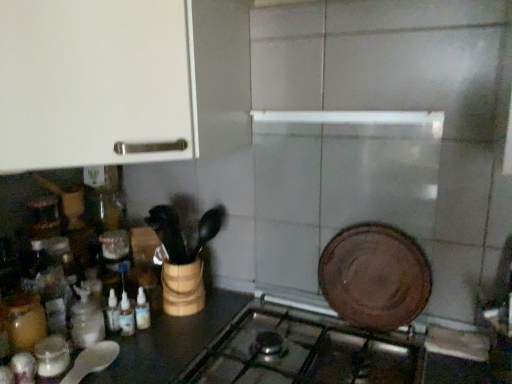
Question: Considering the relative sizes of translucent glass bottle at lower left, which is the 2th bottle from right to left, and white matte cabinet at upper left in the image provided, is translucent glass bottle at lower left, which is the 2th bottle from right to left, smaller than white matte cabinet at upper left?

Choices:
 (A) no
 (B) yes

Answer: (B)

Question: Considering the relative sizes of translucent glass bottle at lower left, which ranks as the 2th bottle in left-to-right order, and white matte cabinet at upper left in the image provided, is translucent glass bottle at lower left, which ranks as the 2th bottle in left-to-right order, bigger than white matte cabinet at upper left?

Choices:
 (A) no
 (B) yes

Answer: (A)

Question: Considering the relative sizes of translucent glass bottle at lower left, which ranks as the 2th bottle in left-to-right order, and white matte cabinet at upper left in the image provided, is translucent glass bottle at lower left, which ranks as the 2th bottle in left-to-right order, shorter than white matte cabinet at upper left?

Choices:
 (A) no
 (B) yes

Answer: (B)

Question: From a real-world perspective, is translucent glass bottle at lower left, which ranks as the 2th bottle in left-to-right order, located beneath white matte cabinet at upper left?

Choices:
 (A) yes
 (B) no

Answer: (A)

Question: Can you see translucent glass bottle at lower left, which ranks as the 2th bottle in left-to-right order, touching white matte cabinet at upper left?

Choices:
 (A) no
 (B) yes

Answer: (A)

Question: Would you say translucent glass bottle at lower left, which ranks as the 2th bottle in left-to-right order, is to the left or to the right of metallic silver gas stove at center in the picture?

Choices:
 (A) right
 (B) left

Answer: (B)

Question: Is point (94, 322) positioned closer to the camera than point (268, 306)?

Choices:
 (A) closer
 (B) farther

Answer: (A)

Question: Do you think translucent glass bottle at lower left, which is the 2th bottle from right to left, is within metallic silver gas stove at center, or outside of it?

Choices:
 (A) outside
 (B) inside

Answer: (A)

Question: Looking at the image, does translucent glass bottle at lower left, which ranks as the 2th bottle in left-to-right order, seem bigger or smaller compared to metallic silver gas stove at center?

Choices:
 (A) big
 (B) small

Answer: (B)

Question: From the image's perspective, is translucent glass bottle at lower left, which ranks as the 2th bottle in left-to-right order, positioned above or below white matte cabinet at upper left?

Choices:
 (A) above
 (B) below

Answer: (B)

Question: Relative to white matte cabinet at upper left, is translucent glass bottle at lower left, which ranks as the 2th bottle in left-to-right order, in front or behind?

Choices:
 (A) behind
 (B) front

Answer: (A)

Question: Is translucent glass bottle at lower left, which is the 2th bottle from right to left, taller or shorter than white matte cabinet at upper left?

Choices:
 (A) short
 (B) tall

Answer: (A)

Question: Based on their sizes in the image, would you say translucent glass bottle at lower left, which ranks as the 2th bottle in left-to-right order, is bigger or smaller than white matte cabinet at upper left?

Choices:
 (A) big
 (B) small

Answer: (B)

Question: In terms of width, does metallic silver gas stove at center look wider or thinner when compared to translucent glass bottles at lower left, the 1th bottle viewed from the right?

Choices:
 (A) wide
 (B) thin

Answer: (A)

Question: Choose the correct answer: Is metallic silver gas stove at center inside translucent glass bottles at lower left, the 1th bottle viewed from the right, or outside it?

Choices:
 (A) outside
 (B) inside

Answer: (A)